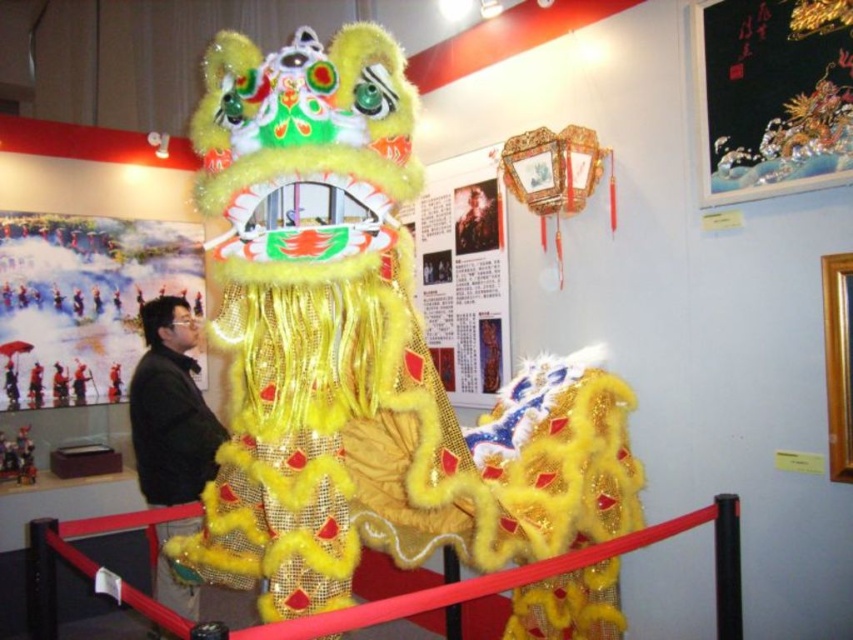
Based on the photo, you are an event planner setting up a cultural exhibition. You need to place a new decorative item between the matte paper poster at center and the black fabric jacket at center. Which object should the new item be placed closer to, based on their heights?

The matte paper poster at center is not as tall as the black fabric jacket at center, so the new decorative item should be placed closer to the matte paper poster at center to maintain visual balance.

You are standing in front of the lion dance exhibit and want to touch both the lion dance costume and the informational panel. The lion dance costume is located at point (59, 365) and the informational panel is at point (735, 561). Which point should you approach first to reach the closer object?

You should approach point (59, 365) first because it is closer to you than point (735, 561), as per the description.

You are an event planner preparing for a cultural festival. You need to hang both the matte paper poster at upper left and the black silk scroll at upper right on a wall that is 2 meters wide. Based on their sizes, can you fit both side by side without overlapping?

The matte paper poster at upper left might be wider than black silk scroll at upper right. Since the total width of both items could exceed 2 meters, it is uncertain if they will fit without overlapping. Check their exact dimensions first.